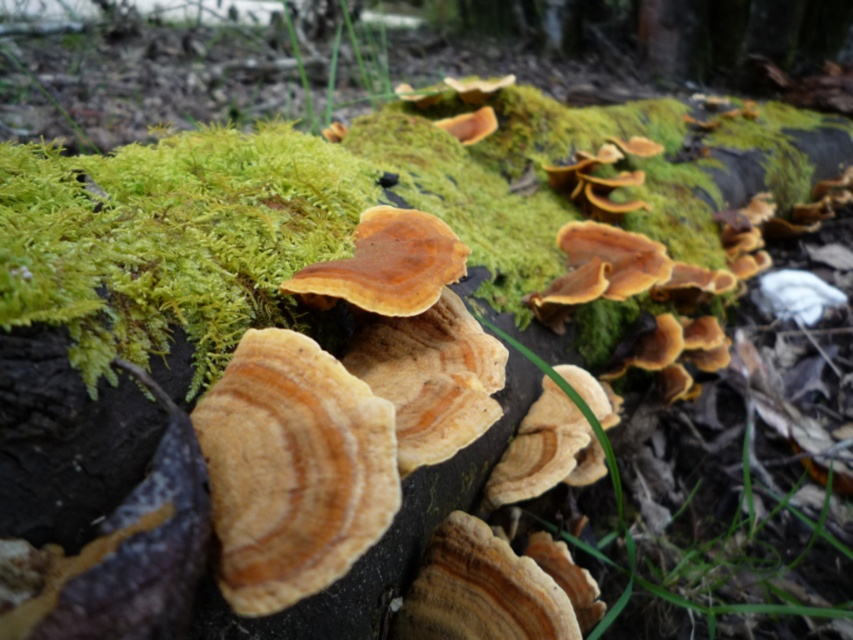
You are a mycologist studying fungi growth. You observe two fungi in the scene. Which one has a thinner structure, the light brown textured fungus at center or the brown wood grain fungi at center?

The light brown textured fungus at center is thinner than the brown wood grain fungi at center according to the description.

You are a mycologist examining two fungi in a forest. You observe the light brown textured fungus at center and the brown wood grain fungi at center. Which fungus is taller?

The light brown textured fungus at center is taller than the brown wood grain fungi at center.